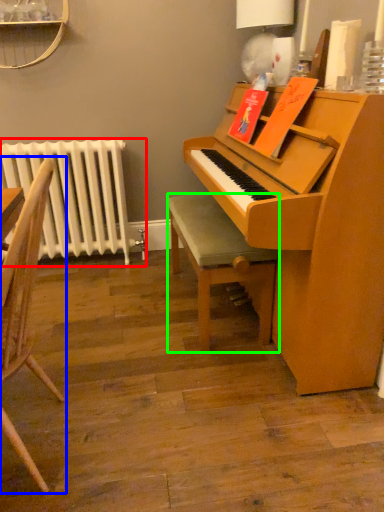
Question: Which object is positioned farthest from radiator (highlighted by a red box)? Select from chair (highlighted by a blue box) and stool (highlighted by a green box).

Choices:
 (A) chair
 (B) stool

Answer: (A)